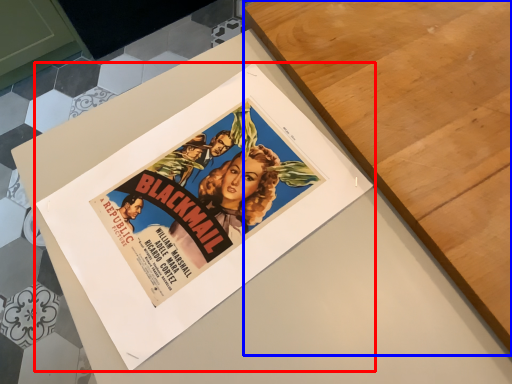
Question: Which object appears farthest to the camera in this image, poster (highlighted by a red box) or table (highlighted by a blue box)?

Choices:
 (A) poster
 (B) table

Answer: (B)